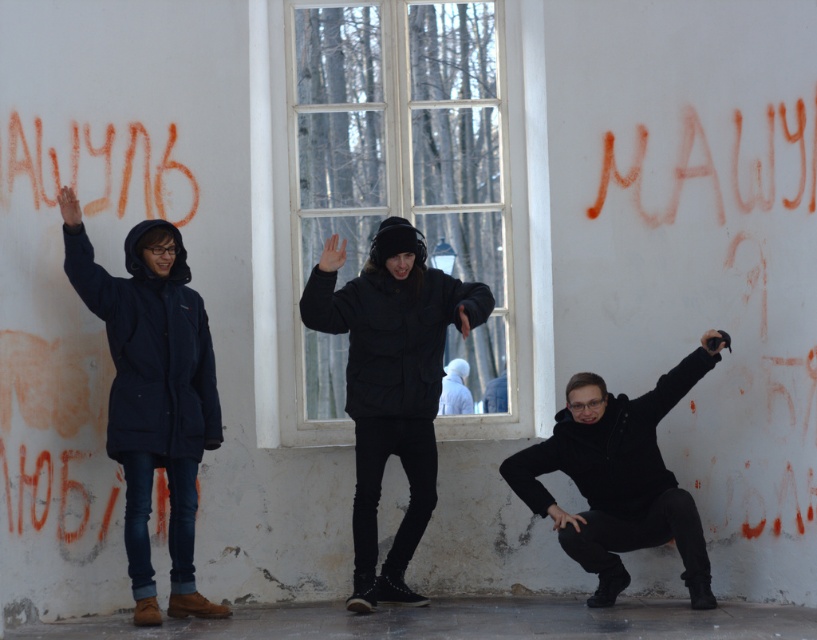
Question: Which object is farther from the camera taking this photo?

Choices:
 (A) black matte jacket at center
 (B) navy blue parka at left

Answer: (A)

Question: Estimate the real-world distances between objects in this image. Which object is farther from the navy blue parka at left?

Choices:
 (A) black matte jacket at lower right
 (B) black matte jacket at center

Answer: (A)

Question: From the image, what is the correct spatial relationship of navy blue parka at left in relation to black matte jacket at center?

Choices:
 (A) right
 (B) left

Answer: (B)

Question: Which object appears farthest from the camera in this image?

Choices:
 (A) black matte jacket at lower right
 (B) black matte jacket at center
 (C) navy blue parka at left

Answer: (A)

Question: Can you confirm if navy blue parka at left is smaller than black matte jacket at lower right?

Choices:
 (A) yes
 (B) no

Answer: (B)

Question: Does black matte jacket at center have a lesser width compared to black matte jacket at lower right?

Choices:
 (A) yes
 (B) no

Answer: (A)